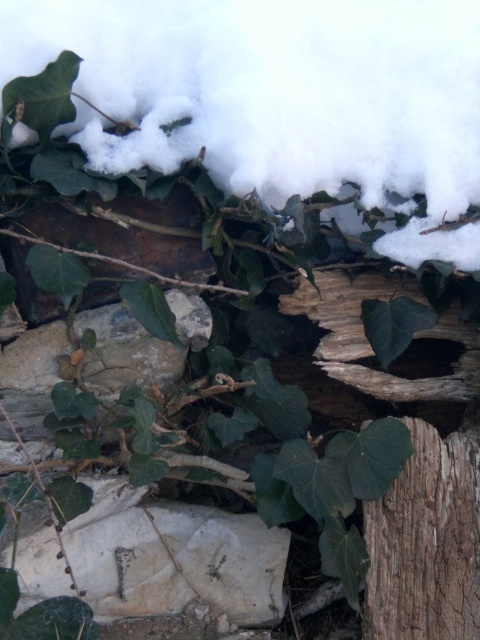
You are an artist trying to paint this scene. You want to ensure the white fluffy snow at upper center and the smooth brown wood at center are positioned correctly. Which object should you paint first to maintain the proper layering?

You should paint the smooth brown wood at center first because the white fluffy snow at upper center is in front of it, so painting the background layer first allows the snow to be placed over it.

You are standing in the winter scene and want to place a small decorative ornament on the smooth brown wood at center. However, you need to ensure that the ornament won not be covered by the white fluffy snow at upper center. Based on their positions, can you determine if the snow is positioned in a way that might cover the ornament if placed on the wood?

The white fluffy snow at upper center is to the left of the smooth brown wood at center, so placing the ornament on the smooth brown wood at center would not be covered by the snow since it is positioned to the left of the wood.

You are a bird flying over the winter scene depicted in the image. You want to land on the white fluffy snow at upper center. Based on its coordinates, can you estimate whether this area is centrally located in the image?

The white fluffy snow at upper center is located at coordinates point (278, 97), which places it closer to the left side rather than the center of the image. Therefore, it is not centrally located.